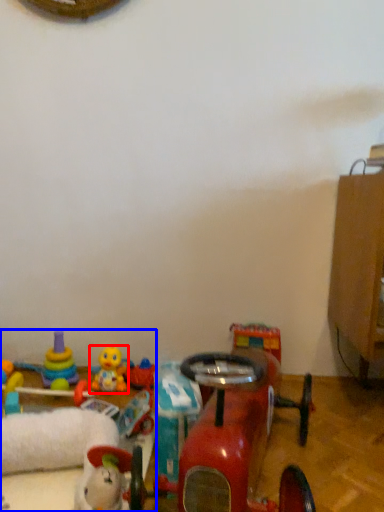
Question: Among these objects, which one is nearest to the camera, toy (highlighted by a red box) or toy (highlighted by a blue box)?

Choices:
 (A) toy
 (B) toy

Answer: (B)